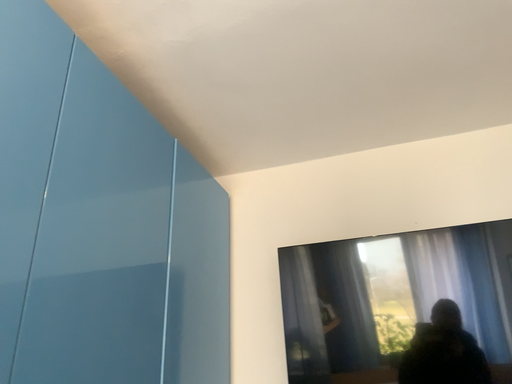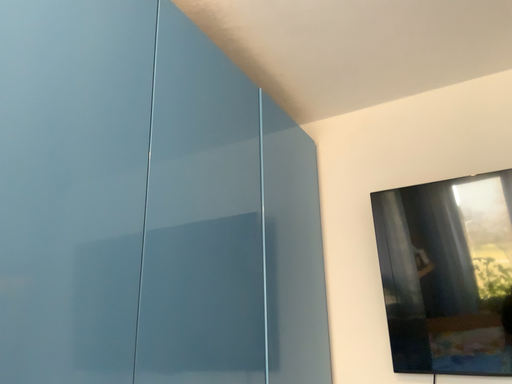
Question: Which way did the camera rotate in the video?

Choices:
 (A) rotated left
 (B) rotated right

Answer: (A)